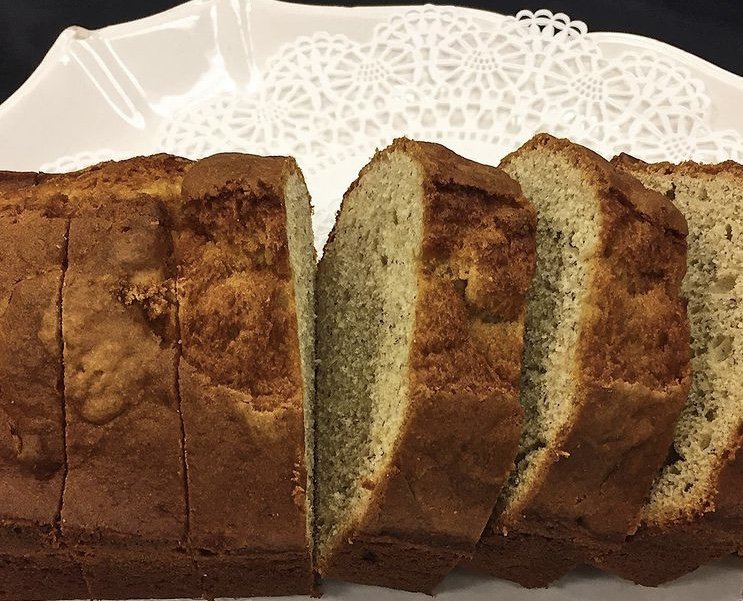
At what (x,y) coordinates should I click in order to perform the action: click on plate. Please return your answer as a coordinate pair (x, y). Looking at the image, I should click on (203, 68).